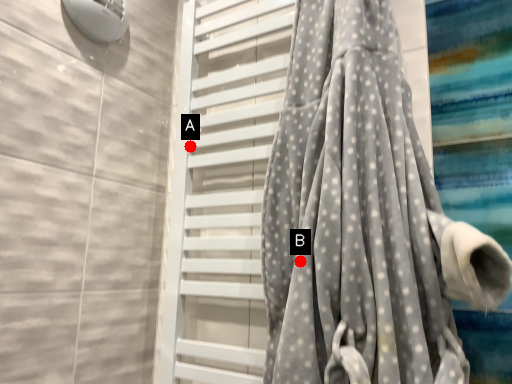
Question: Two points are circled on the image, labeled by A and B beside each circle. Which point is closer to the camera taking this photo?

Choices:
 (A) A is closer
 (B) B is closer

Answer: (B)